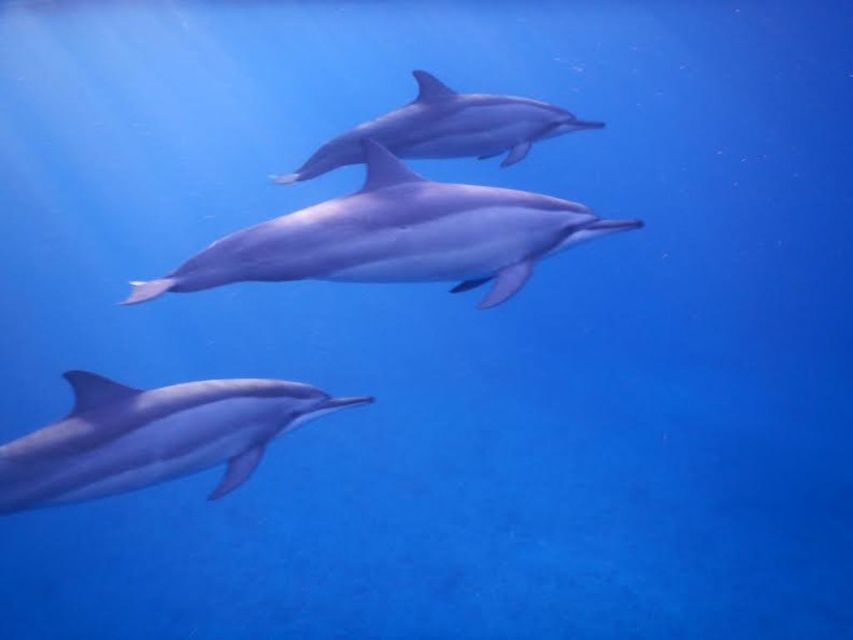
You are a marine biologist studying dolphin behavior underwater. You observe a smooth gray dolphin at center swimming in a deep blue ocean. Based on its 2D coordinates, can you determine if it is positioned exactly at the center of the image?

The smooth gray dolphin at center is located at coordinates point (395, 237), which is not exactly at the center of the image. The center would typically be at coordinates like (426, 320), so this dolphin is slightly to the left and above the true center.

You are a marine biologist observing three dolphins underwater. You notice a point at coordinates [395,237]. Which dolphin is located at that point?

The point at [395,237] indicates the smooth gray dolphin at center.